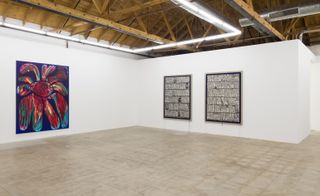
Locate an element on the screen. light brown floorings is located at coordinates (82, 162), (153, 152), (273, 163).